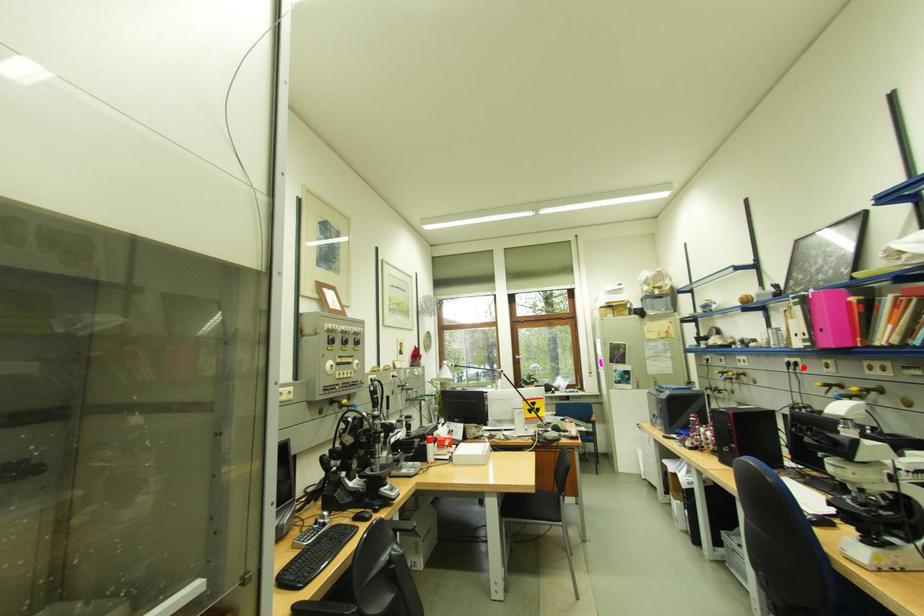
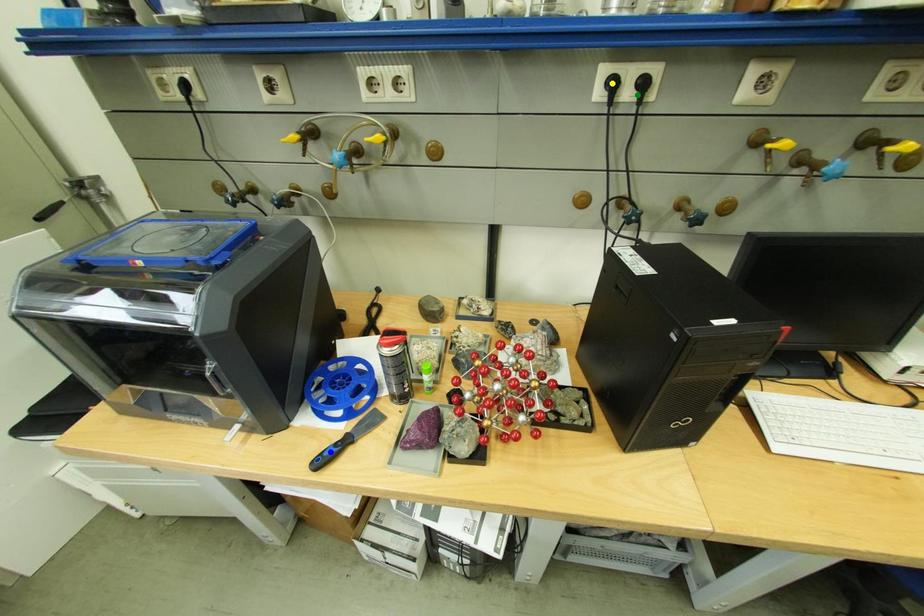
Question: I am providing you with two images of the same scene from different viewpoints. A red point is marked on the first image. You are given multiple points on the second image. Which mark in image 2 goes with the point in image 1?

Choices:
 (A) yellow point
 (B) blue point
 (C) green point

Answer: (C)